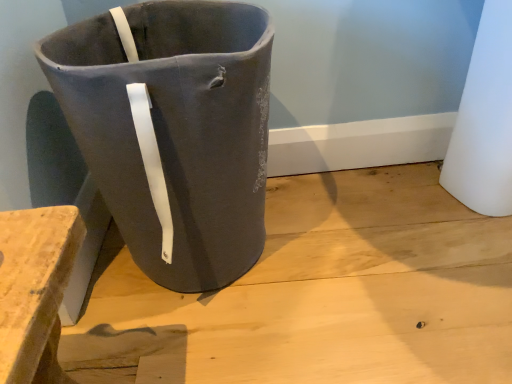
Question: Should I look upward or downward to see matte gray fabric bag at center?

Choices:
 (A) down
 (B) up

Answer: (B)

Question: Does matte gray fabric bag at center appear on the right side of matte gray concrete at center?

Choices:
 (A) no
 (B) yes

Answer: (A)

Question: From a real-world perspective, does matte gray fabric bag at center stand above matte gray concrete at center?

Choices:
 (A) no
 (B) yes

Answer: (B)

Question: Is matte gray fabric bag at center in front of matte gray concrete at center?

Choices:
 (A) no
 (B) yes

Answer: (B)

Question: Is matte gray fabric bag at center with matte gray concrete at center?

Choices:
 (A) yes
 (B) no

Answer: (B)

Question: Is matte gray fabric bag at center outside of matte gray concrete at center?

Choices:
 (A) yes
 (B) no

Answer: (A)

Question: Is matte gray fabric bag at center looking in the opposite direction of matte gray concrete at center?

Choices:
 (A) yes
 (B) no

Answer: (B)

Question: Can you confirm if matte gray concrete at center is taller than matte gray fabric bag at center?

Choices:
 (A) yes
 (B) no

Answer: (B)

Question: Considering the relative sizes of matte gray concrete at center and matte gray fabric bag at center in the image provided, is matte gray concrete at center wider than matte gray fabric bag at center?

Choices:
 (A) no
 (B) yes

Answer: (B)

Question: From the image's perspective, is matte gray concrete at center beneath matte gray fabric bag at center?

Choices:
 (A) no
 (B) yes

Answer: (B)

Question: Is matte gray concrete at center in contact with matte gray fabric bag at center?

Choices:
 (A) yes
 (B) no

Answer: (B)

Question: Is the depth of matte gray concrete at center less than that of matte gray fabric bag at center?

Choices:
 (A) no
 (B) yes

Answer: (A)

Question: Is matte gray concrete at center looking in the opposite direction of matte gray fabric bag at center?

Choices:
 (A) yes
 (B) no

Answer: (B)

Question: Considering their positions, is matte gray fabric bag at center located in front of or behind matte gray concrete at center?

Choices:
 (A) front
 (B) behind

Answer: (A)